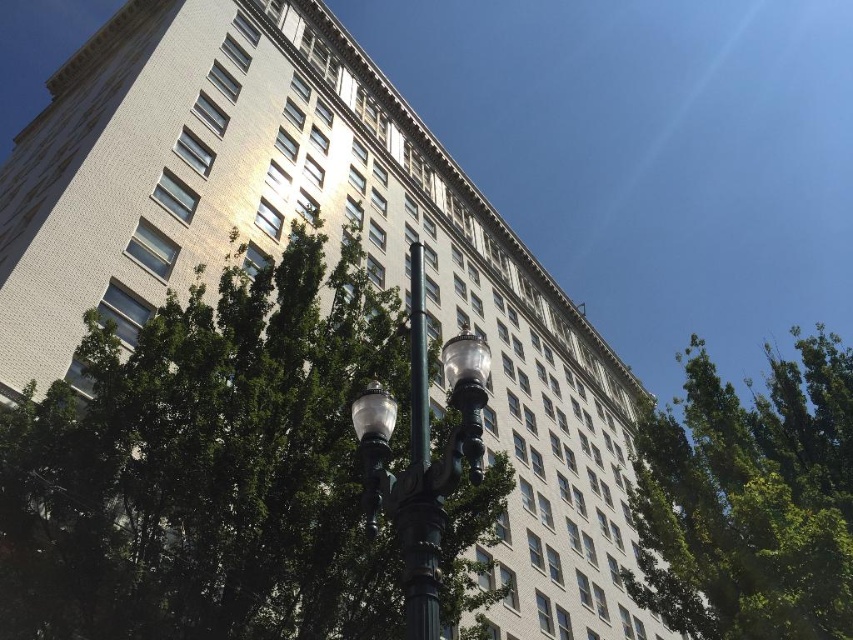
You are a city planner assessing the visibility of the green polished metal street light at center. Considering the presence of the green leafy tree at upper right, which is larger in size, do you think the street light will be easily visible from the sidewalk below?

The green leafy tree at upper right is larger than the green polished metal street light at center, which may block the view of the street light from the sidewalk below. The visibility could be compromised due to the tree obstructing the street light.